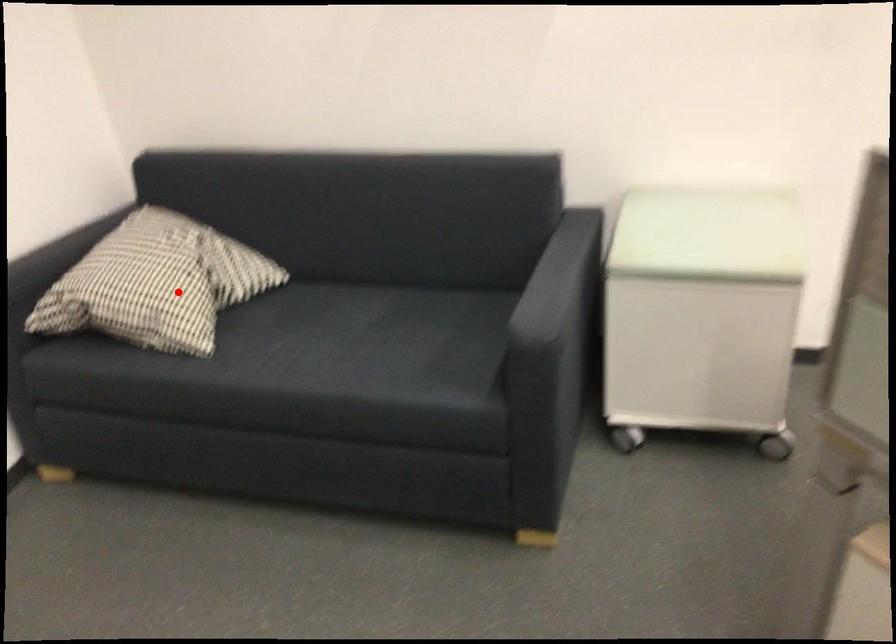
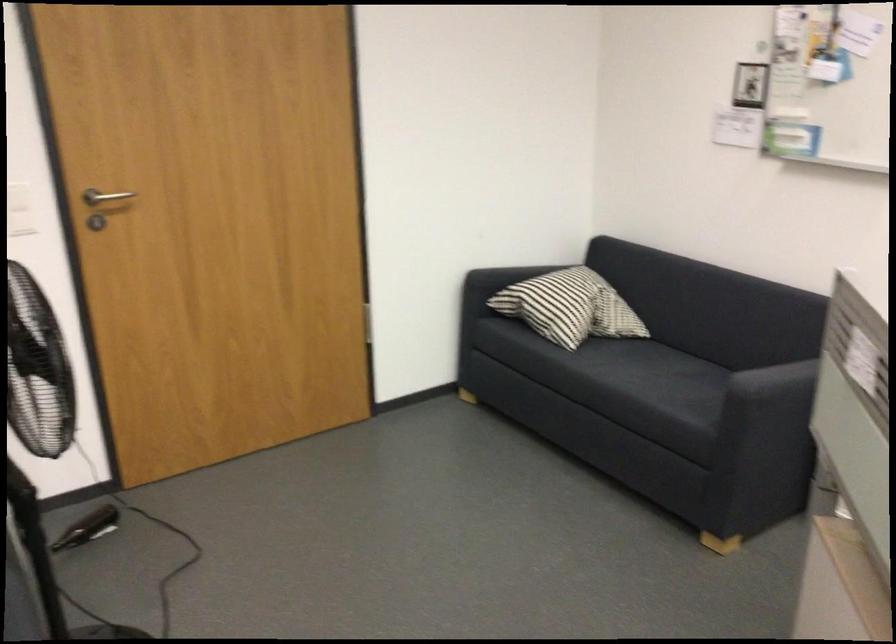
Question: I am providing you with two images of the same scene from different viewpoints. Given a red point in image1, look at the same physical point in image2. Is it:

Choices:
 (A) Closer to the viewpoint
 (B) Farther from the viewpoint

Answer: (B)